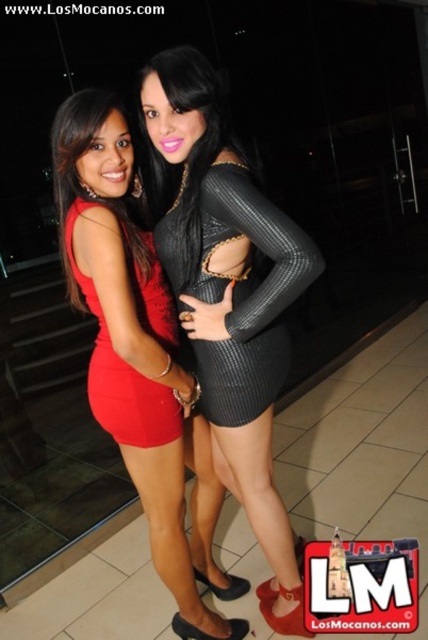
Is matte black dress at center behind matte red dress at left?

No, matte black dress at center is closer to the viewer.

Who is taller, matte black dress at center or matte red dress at left?

With more height is matte black dress at center.

Which is behind, point (139, 253) or point (151, 394)?

The point (151, 394) is more distant.

Locate an element on the screen. This screenshot has height=640, width=428. matte black dress at center is located at coordinates (137, 355).

Between shiny black dress at center and black ribbed dress at center, which one is positioned lower?

shiny black dress at center is lower down.

Can you confirm if shiny black dress at center is wider than black ribbed dress at center?

Indeed, shiny black dress at center has a greater width compared to black ribbed dress at center.

Between point (226, 380) and point (244, 232), which one is positioned in front?

Point (244, 232) is in front.

You are a GUI agent. You are given a task and a screenshot of the screen. Output one action in this format:
    pyautogui.click(x=<x>, y=<y>)
    Task: Click on the shiny black dress at center
    The height and width of the screenshot is (640, 428).
    Given the screenshot: What is the action you would take?
    pyautogui.click(x=231, y=300)

In the scene shown: Which is more to the right, shiny black dress at center or matte red dress at left?

Positioned to the right is shiny black dress at center.

Can you confirm if shiny black dress at center is positioned above matte red dress at left?

Actually, shiny black dress at center is below matte red dress at left.

Is point (303, 612) positioned after point (125, 428)?

Yes, point (303, 612) is farther from viewer.

This screenshot has width=428, height=640. Find the location of `shiny black dress at center`. shiny black dress at center is located at coordinates coord(231,300).